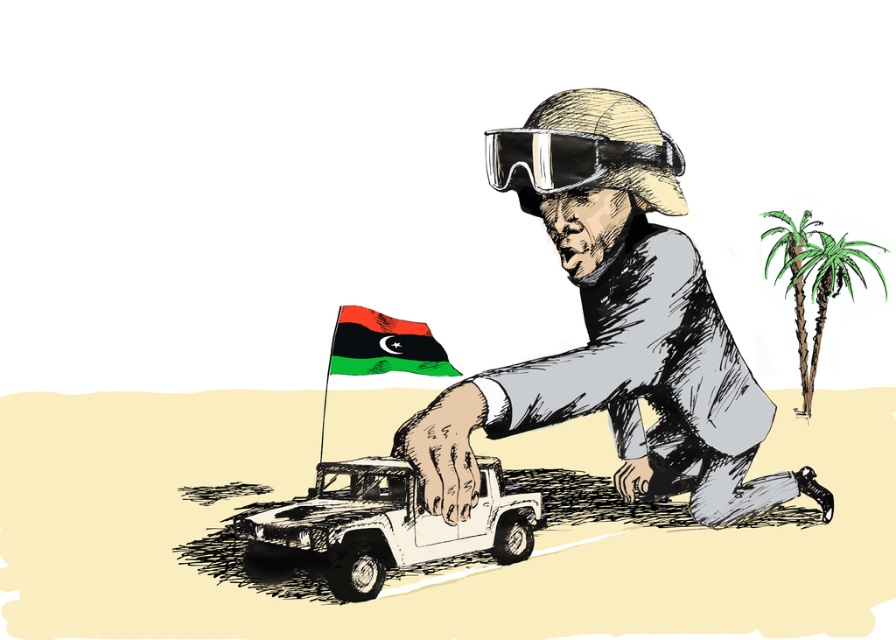
You are a photographer trying to capture the clear plastic goggles at upper center and the green textured palm tree at right in the same frame. Based on their sizes in the image, which object will appear smaller in the photo?

The clear plastic goggles at upper center occupies less space than the green textured palm tree at right, so it will appear smaller in the photo.

You are a photographer positioned in the desert scene. You need to capture a photo that includes both the white matte truck at center and the green leafy palm tree at right. Based on their positions, which object should be placed on the left side of the photo frame?

The white matte truck at center should be placed on the left side of the photo frame because it is positioned to the left of the green leafy palm tree at right.

You are a photographer setting up a shot in the desert scene. You have a camera with a 30cm wide lens. The white matte truck at center and the green leafy palm tree at right are both in your frame. Can you fit both objects in your shot if the total width available is 50cm?

The white matte truck at center is wider than the green leafy palm tree at right. Since the total width of both objects combined would exceed 50cm, you cannot fit both in the shot.